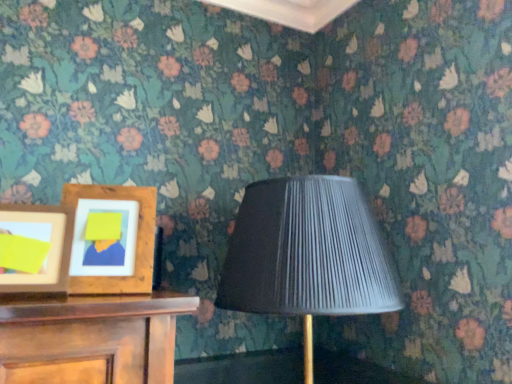
Question: Considering their positions, is wooden picture frame at left, which ranks as the first picture frame in left-to-right order, located in front of or behind wooden picture frame at left, the first picture frame in the right-to-left sequence?

Choices:
 (A) behind
 (B) front

Answer: (B)

Question: Is point (25, 261) closer or farther from the camera than point (92, 283)?

Choices:
 (A) closer
 (B) farther

Answer: (A)

Question: Estimate the real-world distances between objects in this image. Which object is closer to the wooden picture frame at left, placed as the 2th picture frame when sorted from left to right?

Choices:
 (A) wooden picture frame at left, the second picture frame viewed from the right
 (B) matte black lampshade at center

Answer: (A)

Question: Which object is positioned closest to the matte black lampshade at center?

Choices:
 (A) wooden picture frame at left, which ranks as the first picture frame in left-to-right order
 (B) wooden picture frame at left, the first picture frame in the right-to-left sequence

Answer: (B)